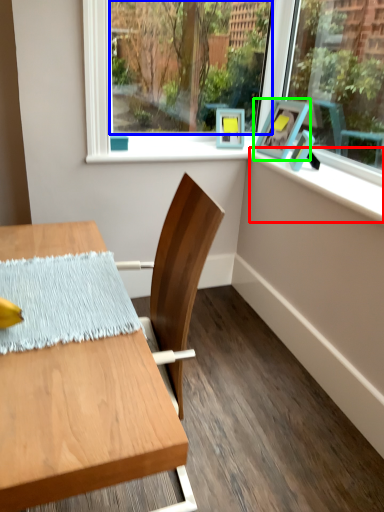
Question: Which object is the farthest from window sill (highlighted by a red box)? Choose among these: window screen (highlighted by a blue box) or picture frame (highlighted by a green box).

Choices:
 (A) window screen
 (B) picture frame

Answer: (A)